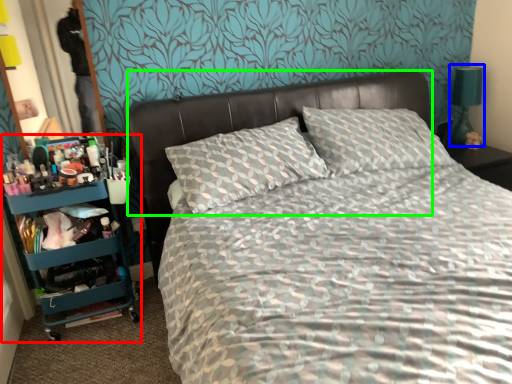
Question: Which object is the closest to the bookshelf (highlighted by a red box)? Choose among these: bedside lamp (highlighted by a blue box) or headboard (highlighted by a green box).

Choices:
 (A) bedside lamp
 (B) headboard

Answer: (B)